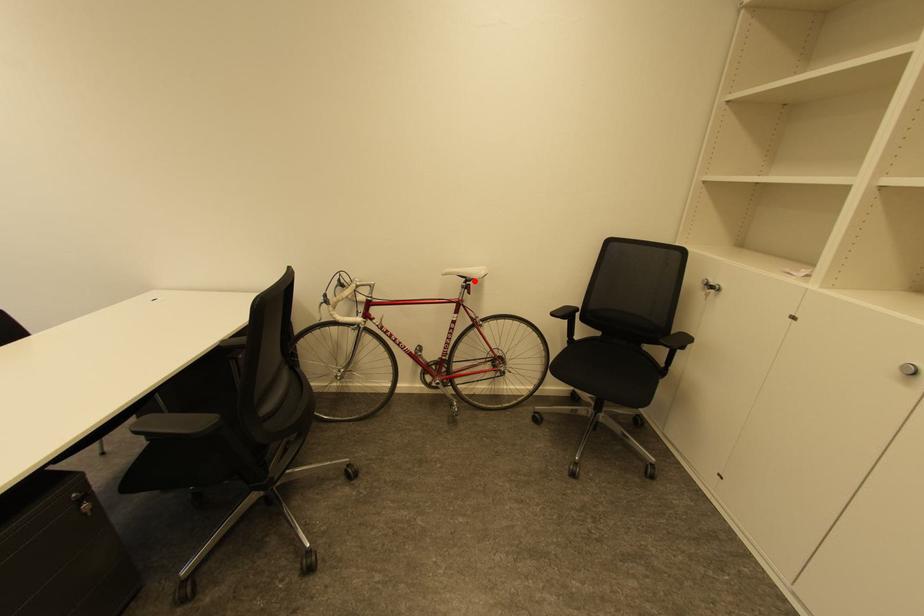
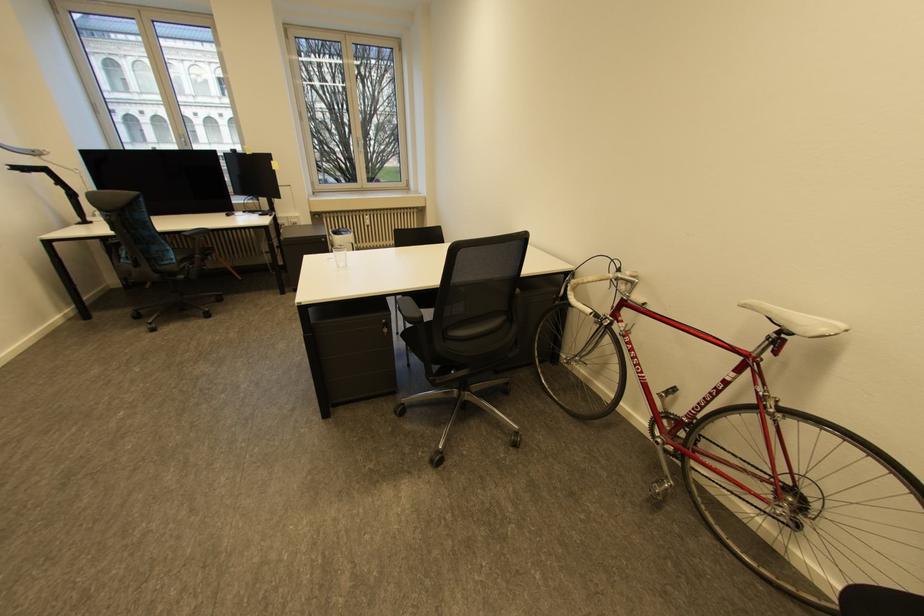
Find the pixel in the second image that matches the highlighted location in the first image.

(789, 331)